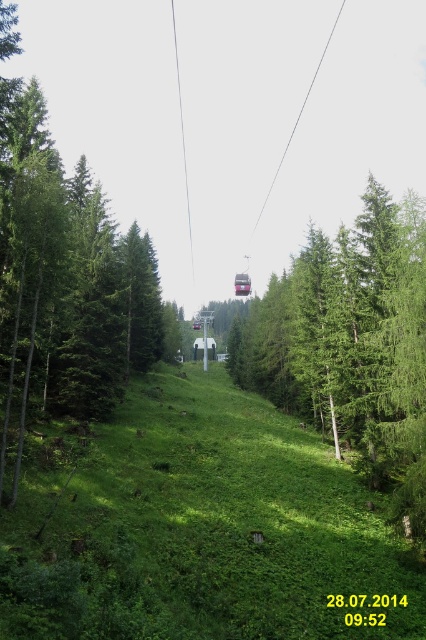
You are a hiker standing on the grassy hillside and want to take a photo of both the green matte tree at center and the green leafy tree at center. Which tree should you move closer to in order to include both trees in the frame without zooming in?

You should move closer to the green matte tree at center because it is smaller than the green leafy tree at center, allowing you to fit both into the frame by reducing the distance between yourself and the smaller tree.

You are standing at the point marked as point (63, 285) in the image. What object is located exactly at that point?

The green matte tree at center is located exactly at point (63, 285).

You are standing on the grassy hillside and notice two trees at the center of the scene. Which tree, the green matte tree at center or the green leafy tree at center, is positioned higher up in the image?

The green matte tree at center is located above the green leafy tree at center, so it is positioned higher up in the image.